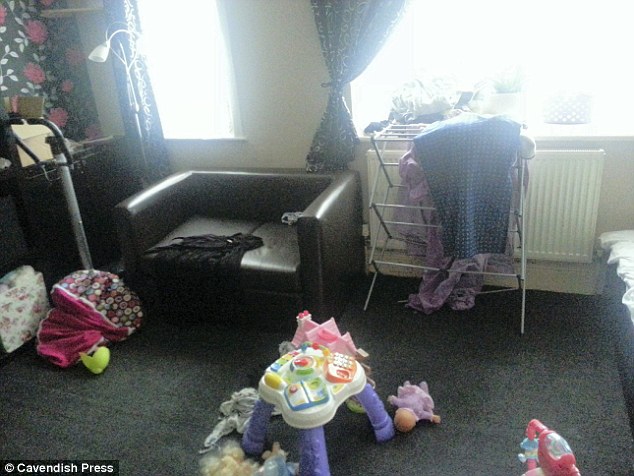
At what (x,y) coordinates should I click in order to perform the action: click on toddler girl toy. Please return your answer as a coordinate pair (x, y). The height and width of the screenshot is (476, 634). Looking at the image, I should click on (309, 380), (560, 461), (96, 364).